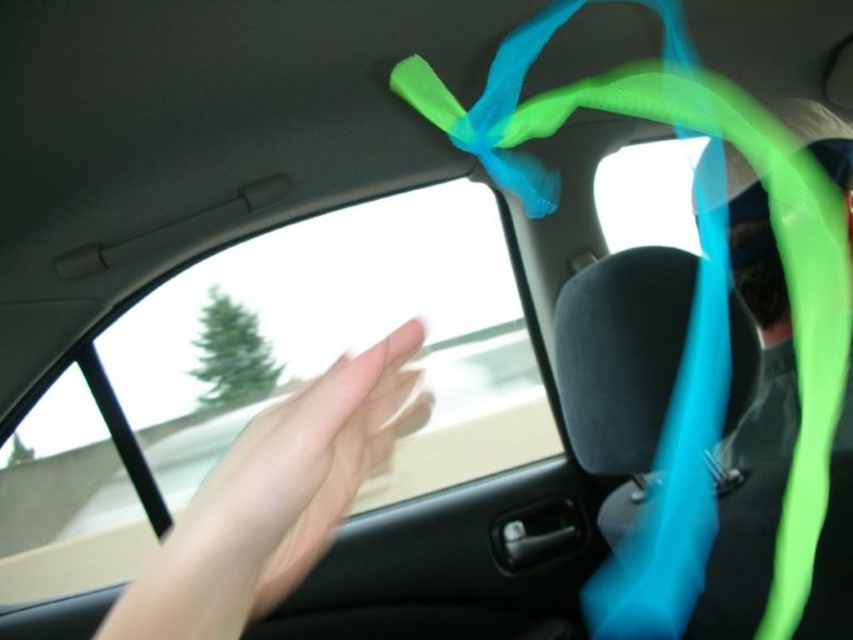
Question: Which point is farther to the camera?

Choices:
 (A) (6, 531)
 (B) (280, 476)

Answer: (A)

Question: Does transparent glass car window at center have a lesser width compared to pale skin hand at center?

Choices:
 (A) no
 (B) yes

Answer: (A)

Question: Where is transparent glass car window at center located in relation to pale skin hand at center in the image?

Choices:
 (A) right
 (B) left

Answer: (B)

Question: In this image, where is transparent glass car window at center located relative to pale skin hand at center?

Choices:
 (A) right
 (B) left

Answer: (B)